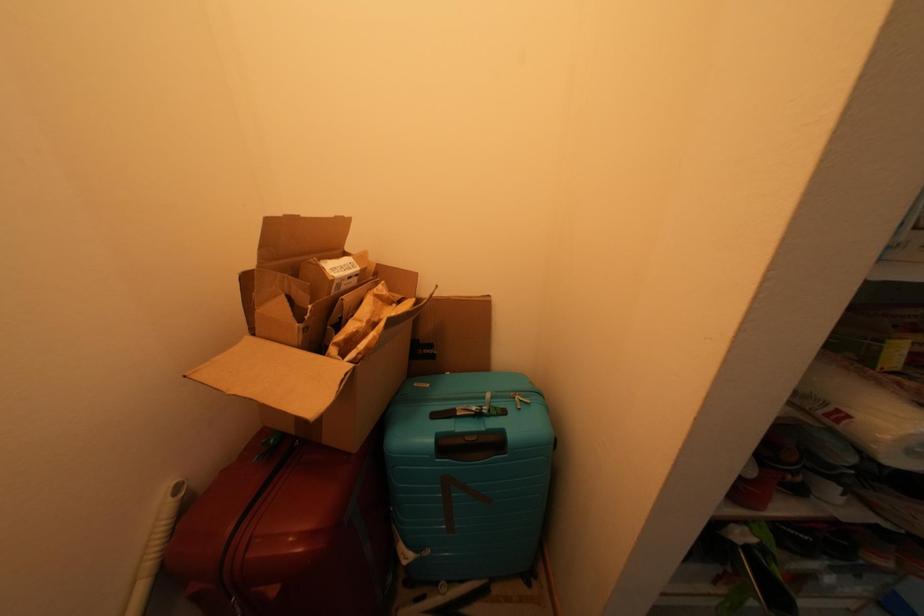
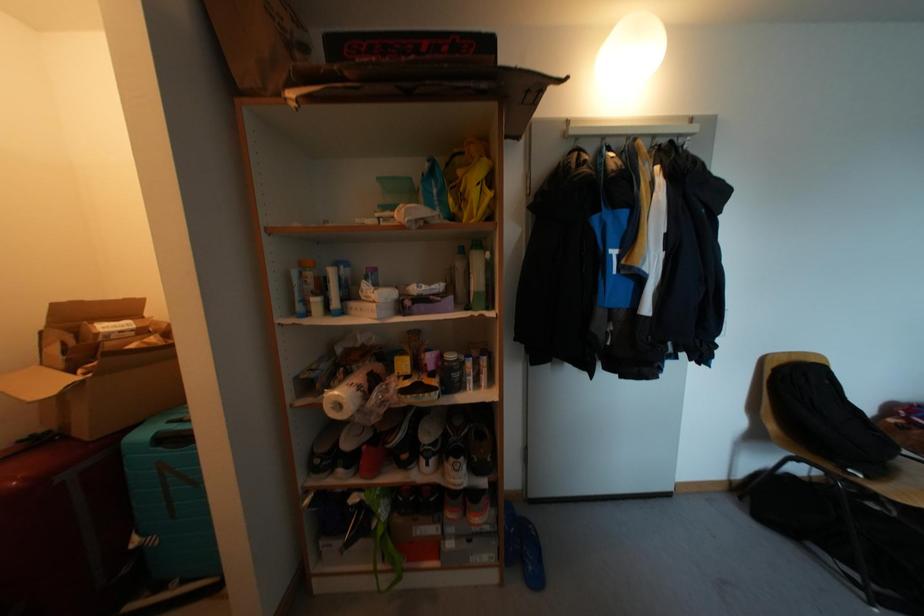
What movement of the cameraman would produce the second image?

The movement direction of the cameraman is right, backward.